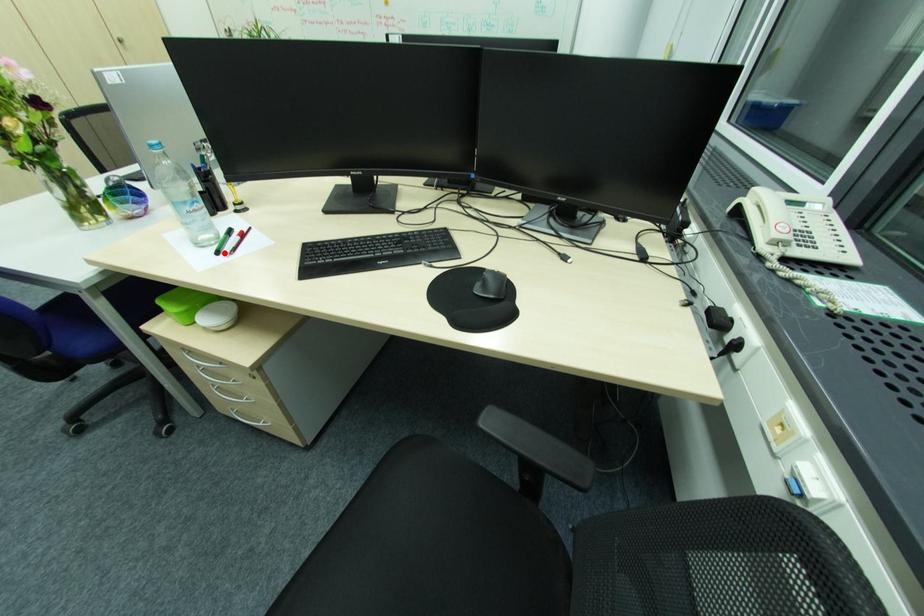
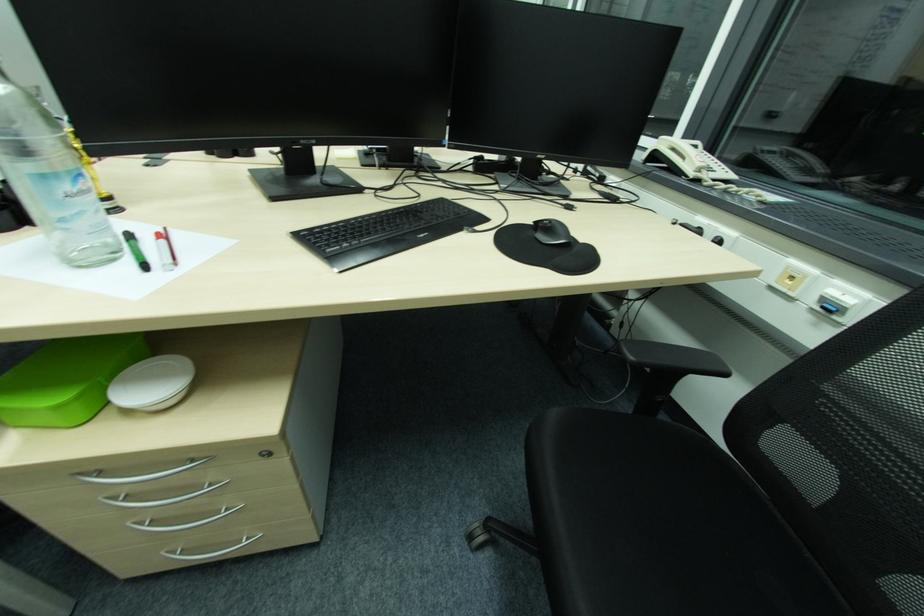
Where in the second image is the point corresponding to the highlighted location from the first image?

(149, 267)